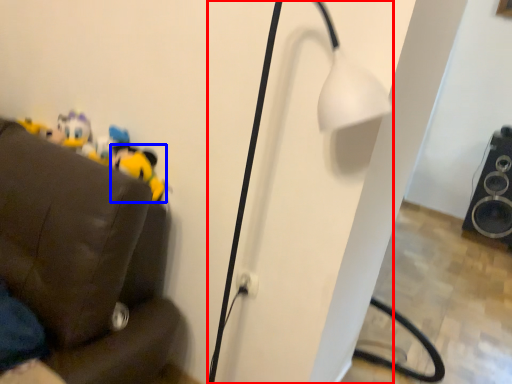
Question: Which object appears farthest to the camera in this image, lamp (highlighted by a red box) or toy (highlighted by a blue box)?

Choices:
 (A) lamp
 (B) toy

Answer: (B)